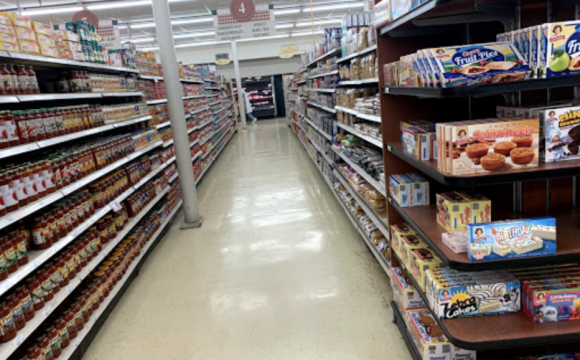
Where is `support post`? support post is located at coordinates (176, 118), (235, 68).